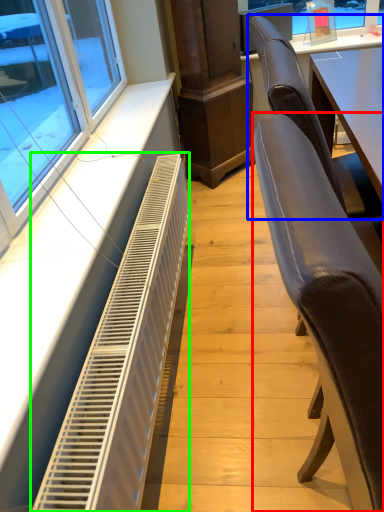
Question: Which is farther away from chair (highlighted by a red box)? chair (highlighted by a blue box) or air conditioning (highlighted by a green box)?

Choices:
 (A) chair
 (B) air conditioning

Answer: (B)